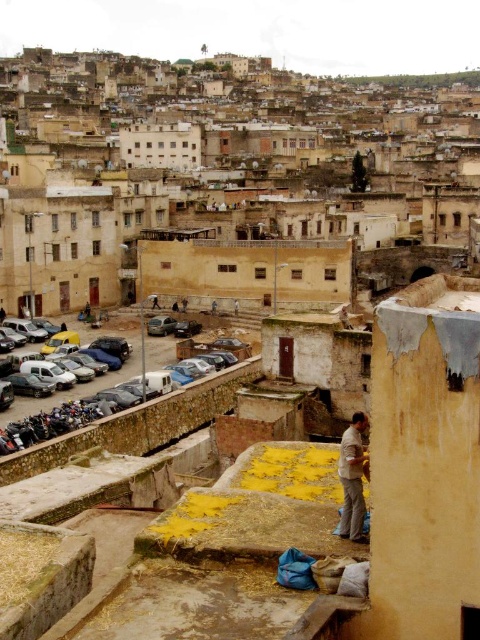
What do you see at coordinates (83, 381) in the screenshot?
I see `matte black car at left` at bounding box center [83, 381].

You are a GUI agent. You are given a task and a screenshot of the screen. Output one action in this format:
    pyautogui.click(x=<x>, y=<y>)
    Task: Click on the matte black car at left
    The width and height of the screenshot is (480, 640).
    Given the screenshot: What is the action you would take?
    pyautogui.click(x=83, y=381)